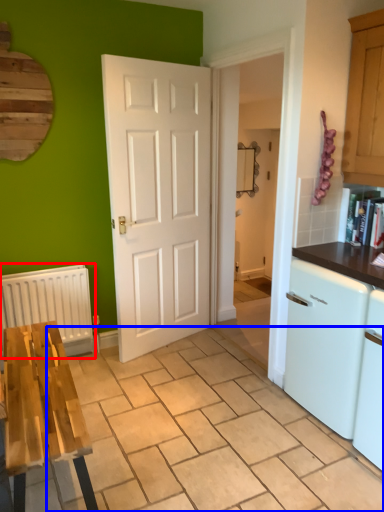
Question: Which point is closer to the camera, radiator (highlighted by a red box) or tile (highlighted by a blue box)?

Choices:
 (A) radiator
 (B) tile

Answer: (B)